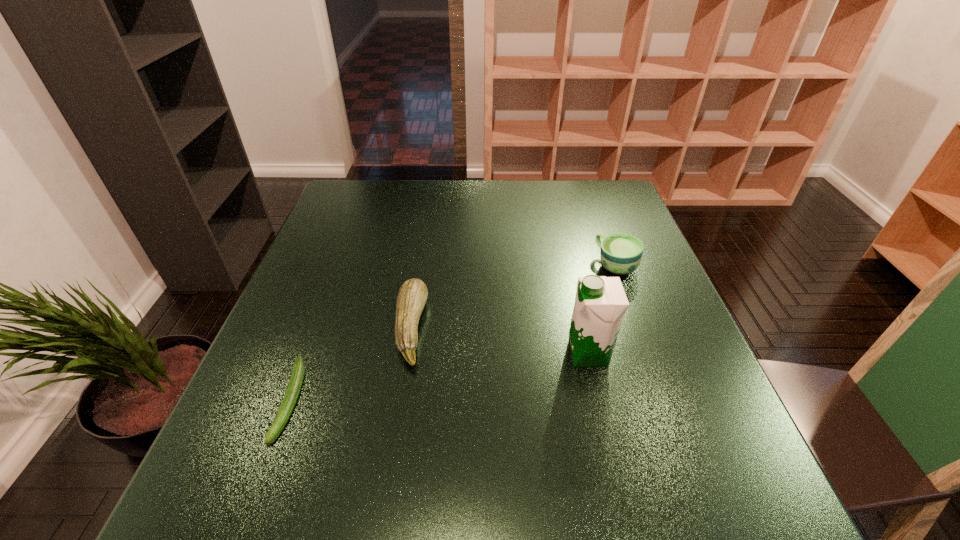
Where is `free space located on the front-facing side of the soya milk`? free space located on the front-facing side of the soya milk is located at coordinates (429, 354).

In order to click on vacant space situated 0.200m on the back of the rightmost object in this screenshot , I will do `click(596, 211)`.

This screenshot has width=960, height=540. Find the location of `blank space located 0.210m at the stem end of the taller zucchini`. blank space located 0.210m at the stem end of the taller zucchini is located at coordinates (520, 328).

Identify the location of free location located on the front-facing side of the leftmost object. This screenshot has width=960, height=540. (256, 495).

Where is `object located in the left edge section of the desktop`? object located in the left edge section of the desktop is located at coordinates (294, 386).

Find the location of a particular element. The image size is (960, 540). object at the right edge is located at coordinates (620, 253).

Identify the location of vacant space at the far edge of the desktop. point(547,219).

Locate an element on the screen. The width and height of the screenshot is (960, 540). vacant space at the near edge is located at coordinates (578, 518).

Find the location of a particular element. vacant region at the left edge is located at coordinates (296, 346).

This screenshot has height=540, width=960. I want to click on vacant space at the right edge of the desktop, so click(686, 455).